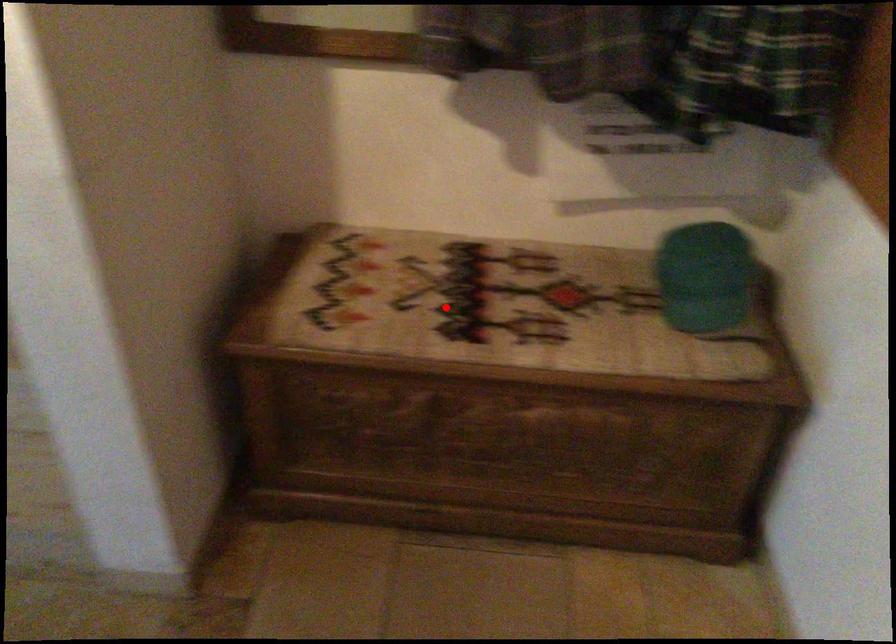
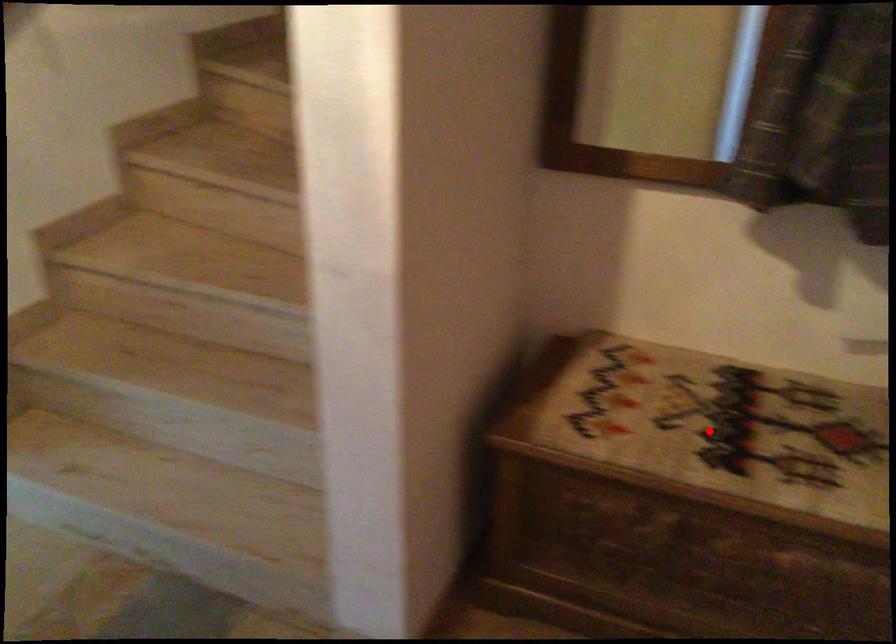
I am providing you with two images of the same scene from different viewpoints. A red point is marked on the first image and another point is marked on the second image. Is the red point in image1 aligned with the point shown in image2?

Yes